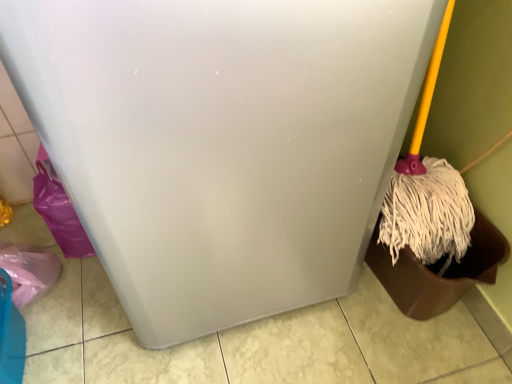
What do you see at coordinates (438, 271) in the screenshot? The height and width of the screenshot is (384, 512). I see `brown plastic waste container at right` at bounding box center [438, 271].

Locate an element on the screen. This screenshot has height=384, width=512. brown plastic waste container at right is located at coordinates (438, 271).

Image resolution: width=512 pixels, height=384 pixels. I want to click on brown plastic waste container at right, so click(438, 271).